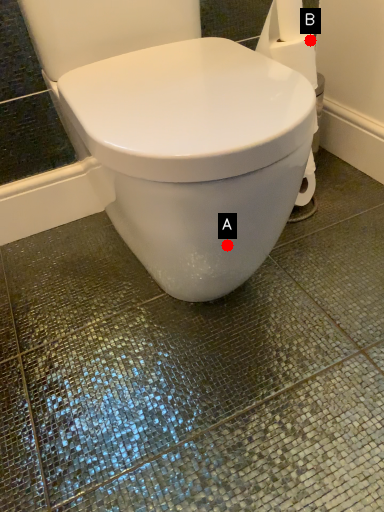
Question: Two points are circled on the image, labeled by A and B beside each circle. Which point is further to the camera?

Choices:
 (A) A is further
 (B) B is further

Answer: (B)